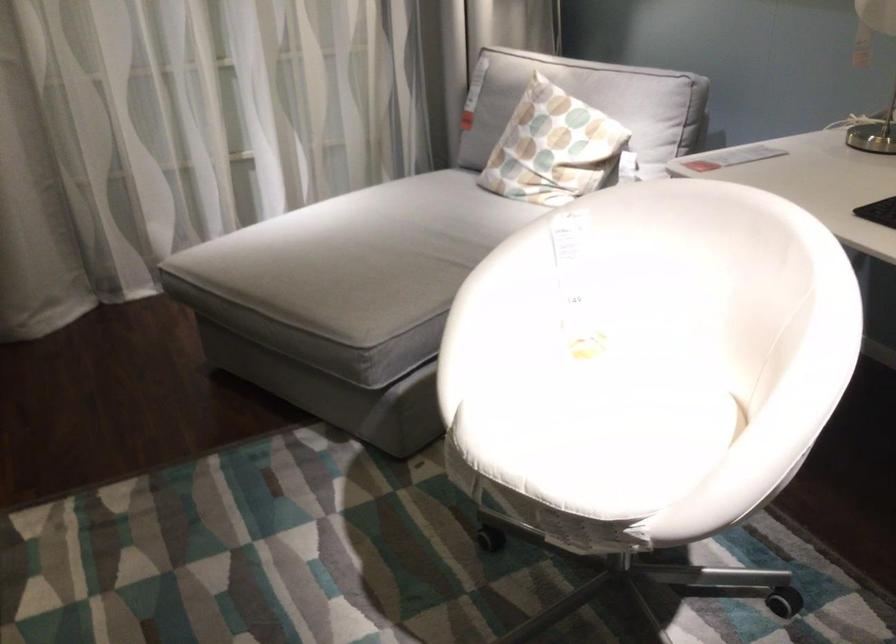
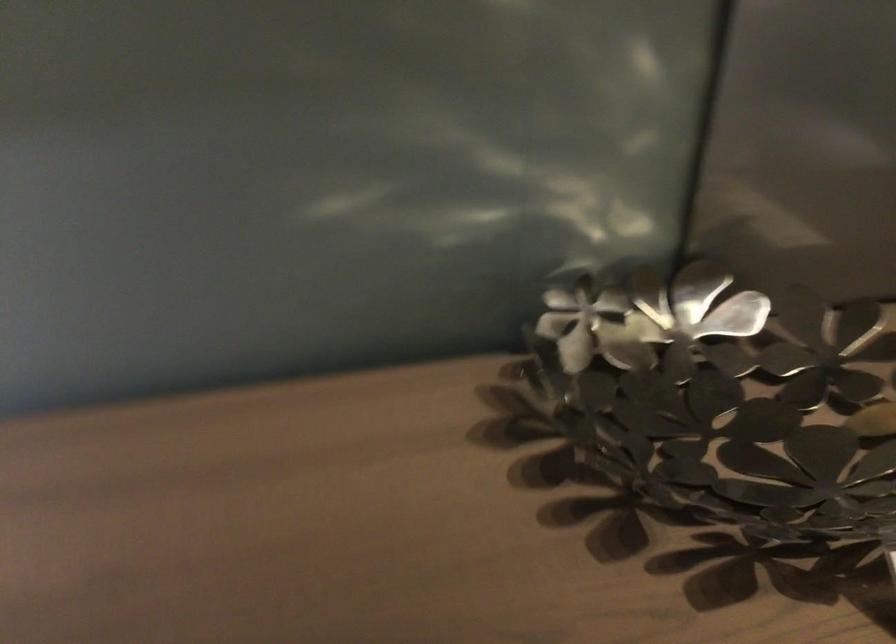
Consider the image. The images are taken continuously from a first-person perspective. In which direction is your viewpoint rotating?

A: The rotation direction of the camera is left-down.